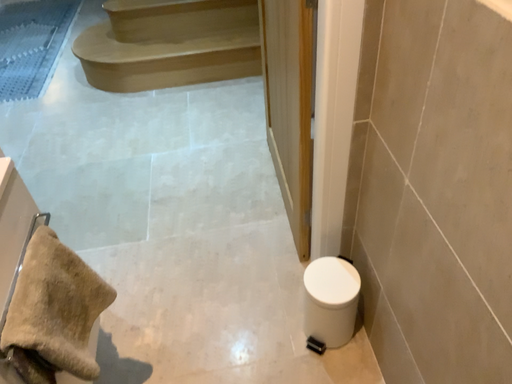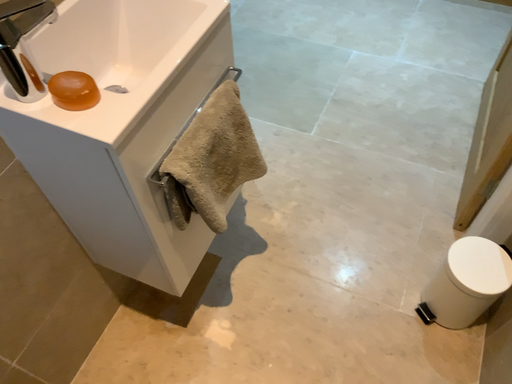
Question: Which way did the camera rotate in the video?

Choices:
 (A) rotated upward
 (B) rotated downward

Answer: (B)